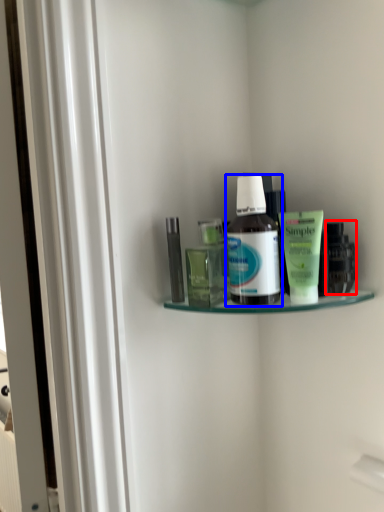
Question: Which object is closer to the camera taking this photo, toiletry (highlighted by a red box) or bottle (highlighted by a blue box)?

Choices:
 (A) toiletry
 (B) bottle

Answer: (B)